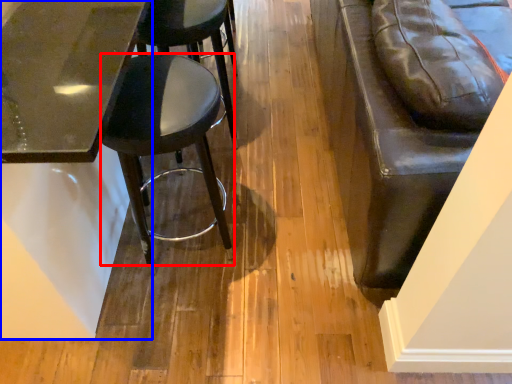
Question: Which object is closer to the camera taking this photo, stool (highlighted by a red box) or table (highlighted by a blue box)?

Choices:
 (A) stool
 (B) table

Answer: (B)